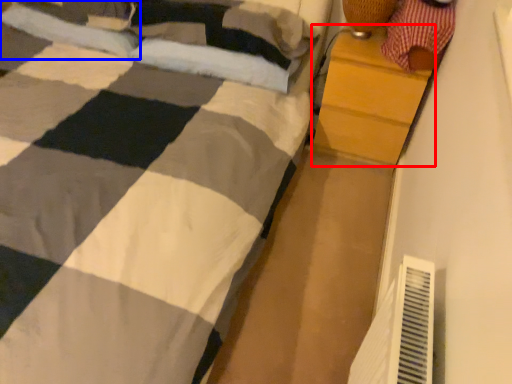
Question: Which object is further to the camera taking this photo, chest of drawers (highlighted by a red box) or pillow (highlighted by a blue box)?

Choices:
 (A) chest of drawers
 (B) pillow

Answer: (B)